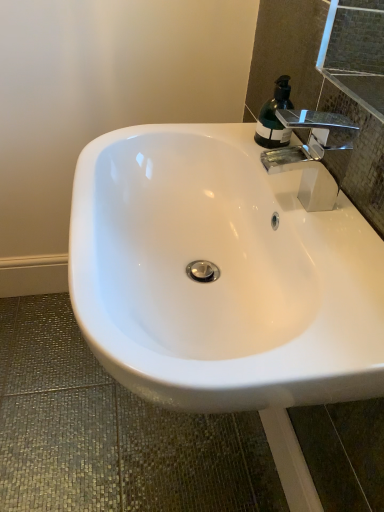
The width and height of the screenshot is (384, 512). I want to click on unoccupied area in front of translucent green bottle at upper right, so click(297, 175).